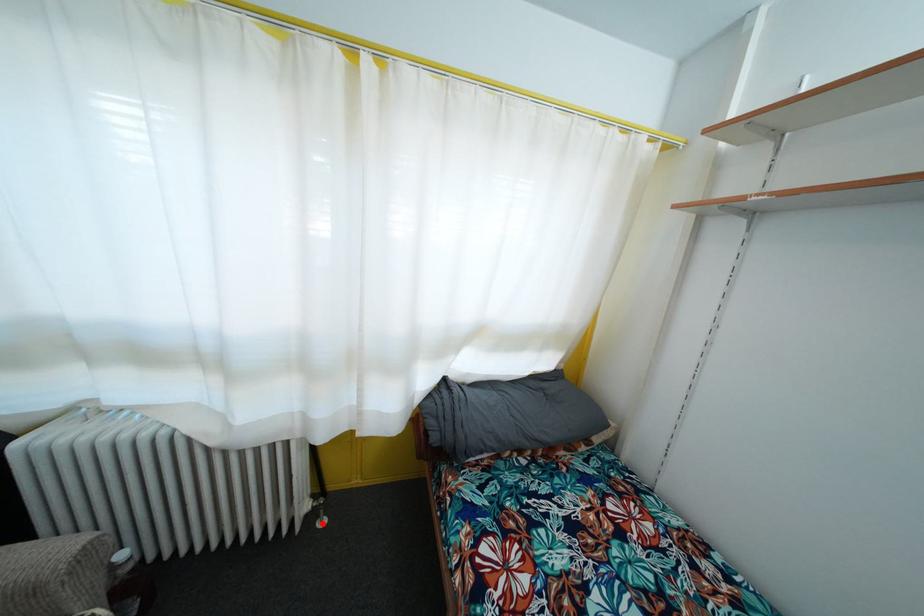
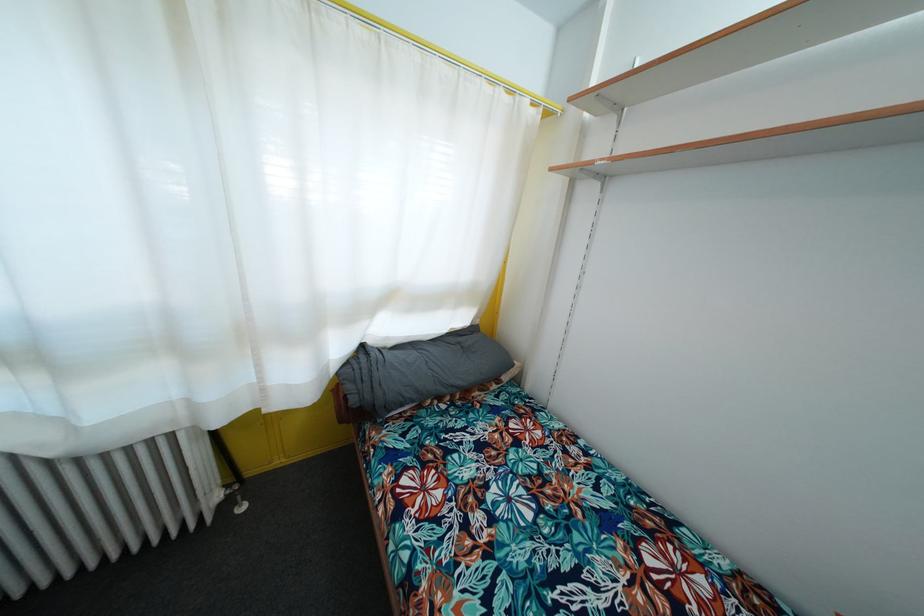
Find the pixel in the second image that matches the highlighted location in the first image.

(240, 511)